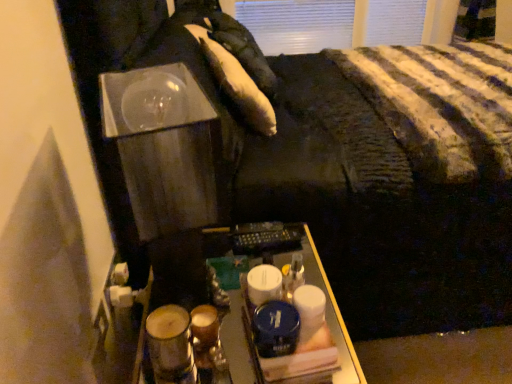
Question: Does metallic remote control at center have a lesser height compared to matte brown glass at lower left?

Choices:
 (A) yes
 (B) no

Answer: (B)

Question: Is metallic remote control at center aimed at matte brown glass at lower left?

Choices:
 (A) no
 (B) yes

Answer: (A)

Question: Is metallic remote control at center further to the viewer compared to matte brown glass at lower left?

Choices:
 (A) no
 (B) yes

Answer: (A)

Question: Does metallic remote control at center have a greater width compared to matte brown glass at lower left?

Choices:
 (A) yes
 (B) no

Answer: (A)

Question: Is metallic remote control at center to the left of matte brown glass at lower left from the viewer's perspective?

Choices:
 (A) no
 (B) yes

Answer: (A)

Question: From the image's perspective, is matte brown glass at lower left positioned above or below metallic remote control at center?

Choices:
 (A) above
 (B) below

Answer: (A)

Question: Is point (187, 375) positioned closer to the camera than point (181, 331)?

Choices:
 (A) closer
 (B) farther

Answer: (B)

Question: Would you say matte brown glass at lower left is to the left or to the right of metallic remote control at center in the picture?

Choices:
 (A) left
 (B) right

Answer: (A)

Question: From a real-world perspective, is matte brown glass at lower left physically located above or below metallic remote control at center?

Choices:
 (A) above
 (B) below

Answer: (A)

Question: Considering the relative positions of white soft pillow at upper center, which is the second pillow in top-to-bottom order, and white soft pillow at upper center, the second pillow in the front-to-back sequence, in the image provided, is white soft pillow at upper center, which is the second pillow in top-to-bottom order, to the left or to the right of white soft pillow at upper center, the second pillow in the front-to-back sequence,?

Choices:
 (A) right
 (B) left

Answer: (A)

Question: In terms of height, does white soft pillow at upper center, which is counted as the first pillow, starting from the bottom, look taller or shorter compared to white soft pillow at upper center, which appears as the first pillow when viewed from the back?

Choices:
 (A) short
 (B) tall

Answer: (A)

Question: Is white soft pillow at upper center, which is counted as the first pillow, starting from the bottom, in front of or behind white soft pillow at upper center, which appears as the first pillow when viewed from the back, in the image?

Choices:
 (A) behind
 (B) front

Answer: (B)

Question: Is white soft pillow at upper center, which is the second pillow in top-to-bottom order, inside or outside of white soft pillow at upper center, which appears as the first pillow when viewed from the back?

Choices:
 (A) outside
 (B) inside

Answer: (A)

Question: Considering the positions of white soft pillow at upper center, the second pillow in the front-to-back sequence, and matte brown glass at lower left in the image, is white soft pillow at upper center, the second pillow in the front-to-back sequence, taller or shorter than matte brown glass at lower left?

Choices:
 (A) tall
 (B) short

Answer: (A)

Question: Based on their sizes in the image, would you say white soft pillow at upper center, the second pillow in the front-to-back sequence, is bigger or smaller than matte brown glass at lower left?

Choices:
 (A) small
 (B) big

Answer: (B)